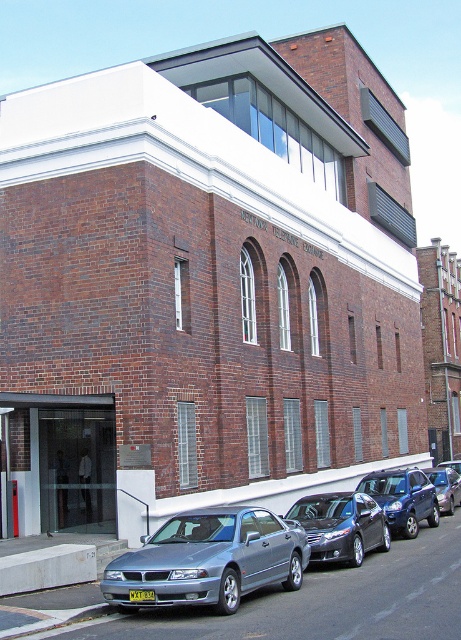
You are a delivery driver who needs to park your metallic silver sedan at center in a spot that requires the vehicle to be taller than the adjacent concrete at lower left. Based on the scene, can your sedan meet this requirement?

The concrete at lower left is not as tall as the metallic silver sedan at center, so the sedan is taller than the concrete, meeting the parking requirement.

You are standing at the entrance of the multi story brick building and want to park your car at the closest parking spot. The parking spots are located at coordinates between 0.8 and 0.9 on the x axis and between 0.4 and 0.5 on the y axis. Is the satin silver sedan at lower center blocking your way to park there?

The satin silver sedan at lower center is located at point (210, 560), which falls within the parking spot coordinates between 0.8 and 0.9 on the x axis and between 0.4 and 0.5 on the y axis. Therefore, the satin silver sedan at lower center is blocking the parking spot.